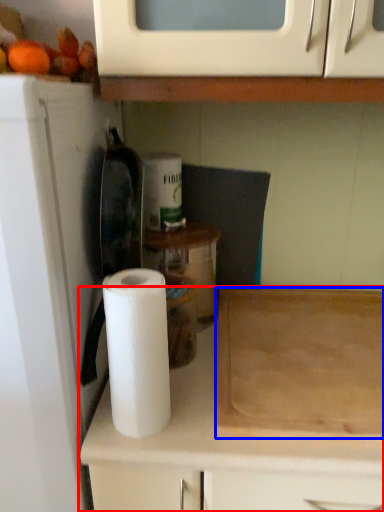
Question: Which object appears farthest to the camera in this image, cabinetry (highlighted by a red box) or cutting board (highlighted by a blue box)?

Choices:
 (A) cabinetry
 (B) cutting board

Answer: (B)